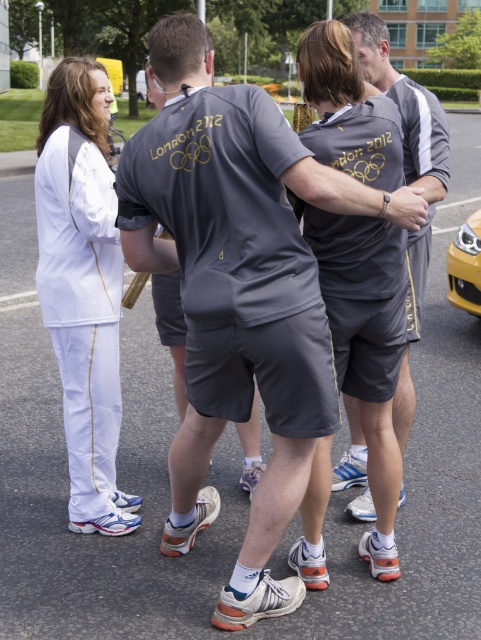
You are a photographer at the London 2012 Olympics. You need to capture a photo of the white smooth uniform at left. Where should you position your camera to ensure the uniform is centered in the frame?

Position your camera so that it is aimed at the coordinates point (83, 289) where the white smooth uniform at left is located to center it in the frame.